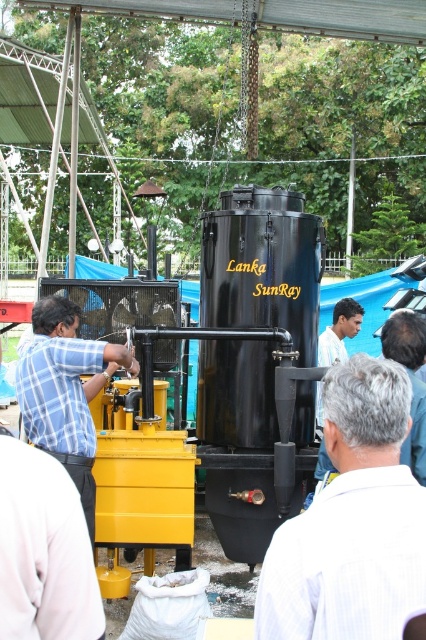
Question: Can you confirm if blue checkered shirt at left is bigger than gray hair at upper right?

Choices:
 (A) yes
 (B) no

Answer: (A)

Question: Which point is closer to the camera?

Choices:
 (A) (319, 524)
 (B) (416, 348)

Answer: (A)

Question: Can you confirm if gray hair at center is positioned above light blue shirt at center?

Choices:
 (A) no
 (B) yes

Answer: (A)

Question: Which point appears farthest from the camera in this image?

Choices:
 (A) (322, 362)
 (B) (396, 620)
 (C) (69, 307)

Answer: (A)

Question: Where is gray hair at center located in relation to light blue shirt at center in the image?

Choices:
 (A) below
 (B) above

Answer: (A)

Question: Which is nearer to the gray hair at upper right?

Choices:
 (A) gray hair at center
 (B) light blue shirt at center

Answer: (A)